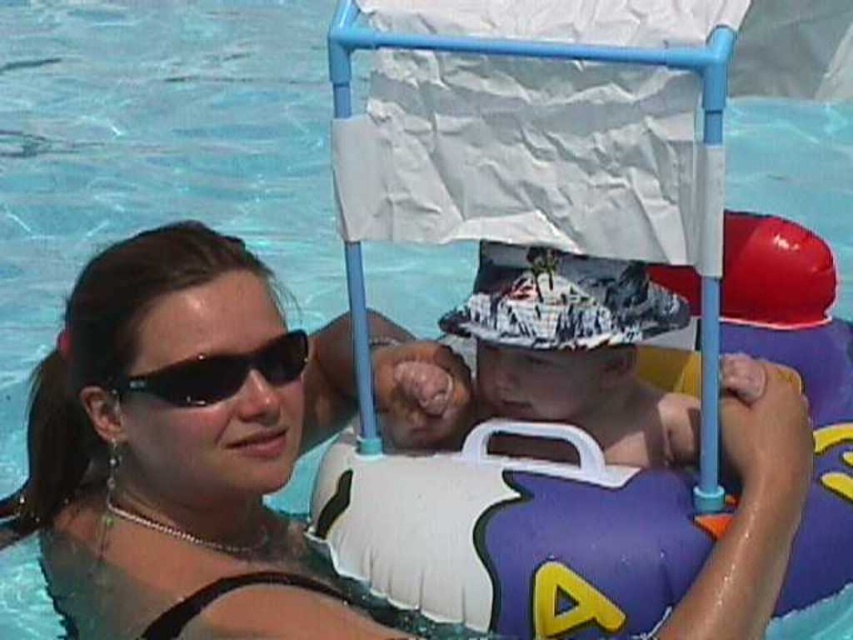
You are a photographer standing at the edge of the pool. You want to take a photo that includes both the adult and the child. The adult is at point (120, 500) and the child is at point (293, 336). Which person should you focus on first to ensure both are in focus?

You should focus on the adult at point (120, 500) first because it is closer to you than the child at point (293, 336). This ensures both will be in focus as the child is further away.

You are a photographer taking a picture of the sunglasses at upper left and the black plastic sunglasses at upper center. Which pair is closer to the bottom of the frame?

The sunglasses at upper left is closer to the bottom of the frame because it is located below the black plastic sunglasses at upper center.

You are a photographer taking a picture of the sunglasses at upper left and the white cotton hat at center. Which object will appear closer to the camera in the photo?

The sunglasses at upper left will appear closer to the camera because they are in front of the white cotton hat at center.